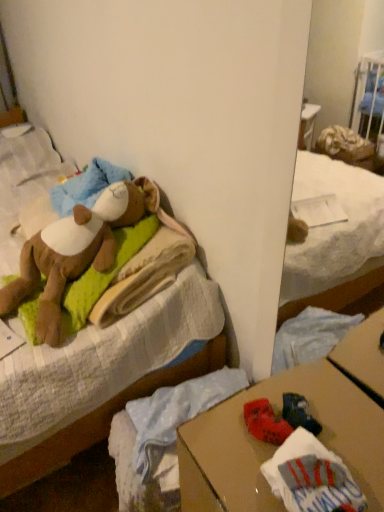
What do you see at coordinates (75, 254) in the screenshot?
I see `soft brown teddy bear at upper left` at bounding box center [75, 254].

The width and height of the screenshot is (384, 512). What are the coordinates of `brown cardboard desk at lower right` in the screenshot? It's located at (275, 447).

Locate an element on the screen. soft brown teddy bear at upper left is located at coordinates pyautogui.click(x=75, y=254).

From a real-world perspective, which object stands above the other?

soft brown teddy bear at upper left is physically above.

Which of these two, brown cardboard desk at lower right or soft brown teddy bear at upper left, stands taller?

Standing taller between the two is brown cardboard desk at lower right.

How distant is brown cardboard desk at lower right from soft brown teddy bear at upper left?

brown cardboard desk at lower right is 65.14 centimeters away from soft brown teddy bear at upper left.

Would you say brown cardboard desk at lower right is outside soft brown teddy bear at upper left?

brown cardboard desk at lower right lies outside soft brown teddy bear at upper left's area.

Image resolution: width=384 pixels, height=512 pixels. In order to click on bed above the brown cardboard desk at lower right (from a real-world perspective) in this screenshot , I will do `click(102, 420)`.

In the image, is brown cardboard desk at lower right positioned in front of or behind soft plush bear at upper left?

Clearly, brown cardboard desk at lower right is in front of soft plush bear at upper left.

Does brown cardboard desk at lower right have a lesser height compared to soft plush bear at upper left?

Correct, brown cardboard desk at lower right is not as tall as soft plush bear at upper left.

Is there a large distance between brown cardboard desk at lower right and soft plush bear at upper left?

They are positioned close to each other.

I want to click on bed on the left side of soft brown teddy bear at upper left, so click(102, 420).

Which is correct: soft brown teddy bear at upper left is inside soft plush bear at upper left, or outside of it?

soft brown teddy bear at upper left can be found inside soft plush bear at upper left.

From the picture: Which is closer to the camera, [91,215] or [221,333]?

Point [91,215] is closer to the camera than point [221,333].

Which object is wider, soft plush bear at upper left or brown cardboard desk at lower right?

Wider between the two is soft plush bear at upper left.

Which is more to the right, soft plush bear at upper left or brown cardboard desk at lower right?

From the viewer's perspective, brown cardboard desk at lower right appears more on the right side.

From a real-world perspective, does soft plush bear at upper left sit lower than brown cardboard desk at lower right?

No, from a real-world perspective, soft plush bear at upper left is not beneath brown cardboard desk at lower right.

Is point (8, 483) less distant than point (297, 388)?

No, it is behind (297, 388).

Is soft plush bear at upper left turned away from soft brown teddy bear at upper left?

No, soft brown teddy bear at upper left is not at the back of soft plush bear at upper left.

Who is more distant, soft plush bear at upper left or soft brown teddy bear at upper left?

soft brown teddy bear at upper left is further from the camera.

How many degrees apart are the facing directions of soft plush bear at upper left and soft brown teddy bear at upper left?

177 degrees.

Considering the sizes of objects soft plush bear at upper left and soft brown teddy bear at upper left in the image provided, who is shorter, soft plush bear at upper left or soft brown teddy bear at upper left?

soft brown teddy bear at upper left is shorter.

From a real-world perspective, is soft brown teddy bear at upper left on top of brown cardboard desk at lower right?

Correct, in the physical world, soft brown teddy bear at upper left is higher than brown cardboard desk at lower right.

In terms of width, does soft brown teddy bear at upper left look wider or thinner when compared to brown cardboard desk at lower right?

Clearly, soft brown teddy bear at upper left has less width compared to brown cardboard desk at lower right.

Is soft brown teddy bear at upper left looking in the opposite direction of brown cardboard desk at lower right?

soft brown teddy bear at upper left does not have its back to brown cardboard desk at lower right.

Looking at this image, would you say soft brown teddy bear at upper left is to the left or to the right of brown cardboard desk at lower right in the picture?

soft brown teddy bear at upper left is positioned on brown cardboard desk at lower right's left side.

At what (x,y) coordinates should I click in order to perform the action: click on desk that is in front of the soft brown teddy bear at upper left. Please return your answer as a coordinate pair (x, y). Image resolution: width=384 pixels, height=512 pixels. Looking at the image, I should click on (275, 447).

In order to click on bed located above the brown cardboard desk at lower right (from a real-world perspective) in this screenshot , I will do `click(102, 420)`.

From the image, which object appears to be nearer to soft brown teddy bear at upper left, brown cardboard desk at lower right or soft plush bear at upper left?

Based on the image, soft plush bear at upper left appears to be nearer to soft brown teddy bear at upper left.

Looking at the image, which one is located further to soft plush bear at upper left, soft brown teddy bear at upper left or brown cardboard desk at lower right?

Based on the image, brown cardboard desk at lower right appears to be further to soft plush bear at upper left.

Based on their spatial positions, is soft brown teddy bear at upper left or soft plush bear at upper left further from brown cardboard desk at lower right?

Among the two, soft brown teddy bear at upper left is located further to brown cardboard desk at lower right.

Based on their spatial positions, is soft plush bear at upper left or soft brown teddy bear at upper left further from brown cardboard desk at lower right?

Based on the image, soft brown teddy bear at upper left appears to be further to brown cardboard desk at lower right.

Which object lies nearer to the anchor point soft plush bear at upper left, brown cardboard desk at lower right or soft brown teddy bear at upper left?

Among the two, soft brown teddy bear at upper left is located nearer to soft plush bear at upper left.

Considering their positions, is soft plush bear at upper left positioned further to soft brown teddy bear at upper left than brown cardboard desk at lower right?

Based on the image, brown cardboard desk at lower right appears to be further to soft brown teddy bear at upper left.

Find the location of `teddy bear situated between soft plush bear at upper left and brown cardboard desk at lower right from left to right`. teddy bear situated between soft plush bear at upper left and brown cardboard desk at lower right from left to right is located at coordinates (75, 254).